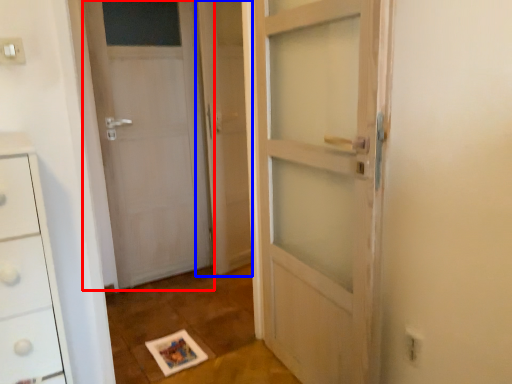
Question: Which of the following is the farthest to the observer, door (highlighted by a red box) or screen door (highlighted by a blue box)?

Choices:
 (A) door
 (B) screen door

Answer: (B)